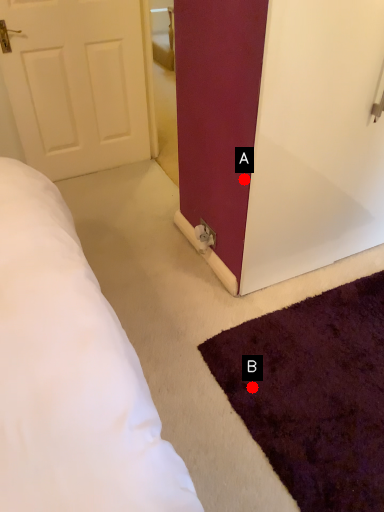
Question: Two points are circled on the image, labeled by A and B beside each circle. Which point is closer to the camera taking this photo?

Choices:
 (A) A is closer
 (B) B is closer

Answer: (B)